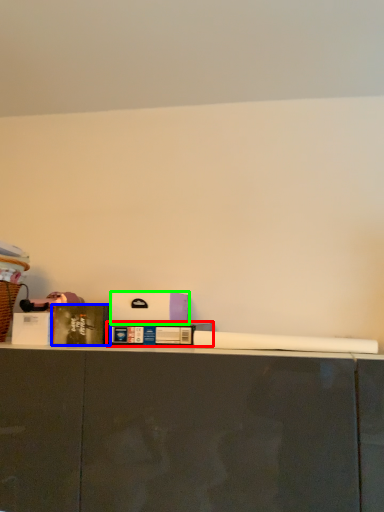
Question: Based on their relative distances, which object is nearer to book (highlighted by a red box)? Choose from book (highlighted by a blue box) and box (highlighted by a green box).

Choices:
 (A) book
 (B) box

Answer: (B)